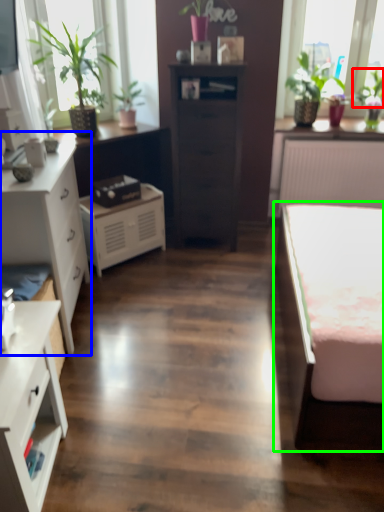
Question: Estimate the real-world distances between objects in this image. Which object is farther from plant (highlighted by a red box), chest of drawers (highlighted by a blue box) or bed (highlighted by a green box)?

Choices:
 (A) chest of drawers
 (B) bed

Answer: (A)